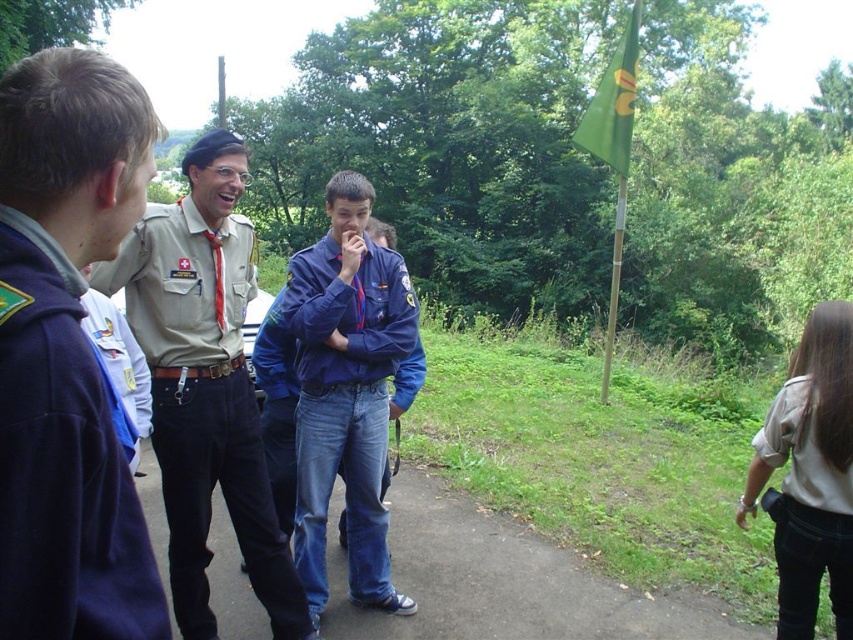
Does point (80, 515) come farther from viewer compared to point (274, 420)?

No.

Can you confirm if navy blue fleece at left is positioned above blue denim jacket at center?

Yes, navy blue fleece at left is above blue denim jacket at center.

Locate an element on the screen. The height and width of the screenshot is (640, 853). navy blue fleece at left is located at coordinates [x=62, y=465].

Is point (288, 381) behind point (618, 120)?

No.

Consider the image. Is blue denim jacket at center bigger than green fabric flag at upper right?

No.

Locate an element on the screen. This screenshot has width=853, height=640. blue denim jacket at center is located at coordinates (276, 404).

Does light beige shirt at lower right appear on the left side of blue denim jacket at center?

Incorrect, light beige shirt at lower right is not on the left side of blue denim jacket at center.

The image size is (853, 640). Describe the element at coordinates (810, 474) in the screenshot. I see `light beige shirt at lower right` at that location.

Does point (780, 403) come farther from viewer compared to point (346, 536)?

No, it is not.

You are a GUI agent. You are given a task and a screenshot of the screen. Output one action in this format:
    pyautogui.click(x=<x>, y=<y>)
    Task: Click on the light beige shirt at lower right
    The width and height of the screenshot is (853, 640).
    Given the screenshot: What is the action you would take?
    pyautogui.click(x=810, y=474)